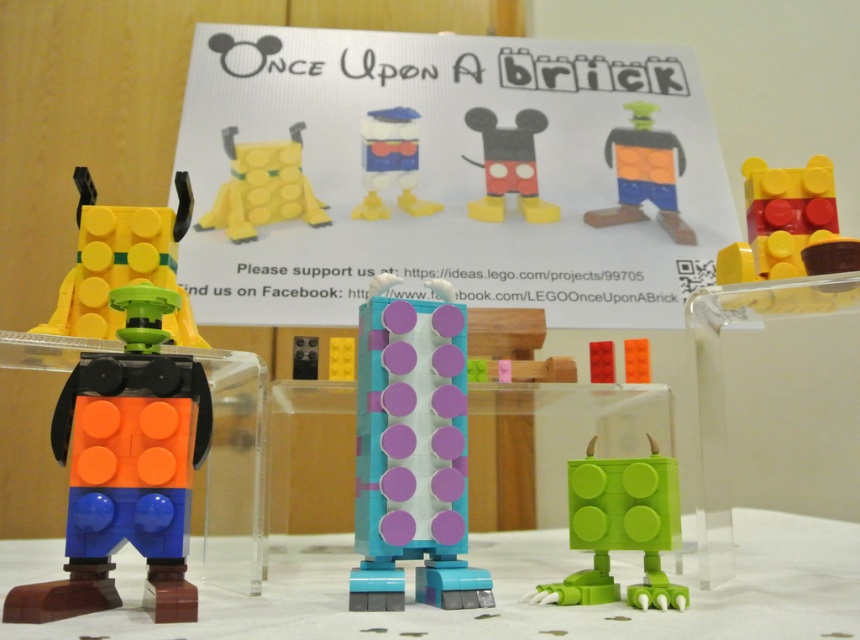
Which is below, white glossy table at center or matte yellow plastic toy at left?

white glossy table at center is lower down.

Does white glossy table at center appear on the right side of matte yellow plastic toy at left?

Yes, white glossy table at center is to the right of matte yellow plastic toy at left.

Where is `white glossy table at center`? white glossy table at center is located at coordinates (511, 593).

Which is in front, point (593, 496) or point (493, 177)?

Point (593, 496)

Who is more forward, [564,582] or [486,148]?

Point [564,582]

The height and width of the screenshot is (640, 860). Find the location of `green matte toy at lower right`. green matte toy at lower right is located at coordinates (619, 529).

Which is behind, point (740, 536) or point (633, 481)?

The point (740, 536) is behind.

The width and height of the screenshot is (860, 640). Describe the element at coordinates (511, 593) in the screenshot. I see `white glossy table at center` at that location.

Who is more forward, (446, 628) or (665, 582)?

Point (446, 628) is in front.

At what (x,y) coordinates should I click in order to perform the action: click on white glossy table at center. Please return your answer as a coordinate pair (x, y). Image resolution: width=860 pixels, height=640 pixels. Looking at the image, I should click on (511, 593).